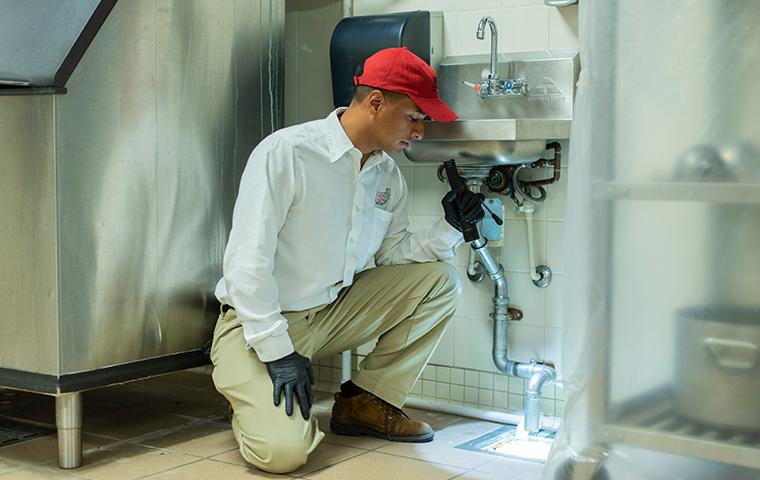
Identify the location of paper towel dispenser. (380, 33).